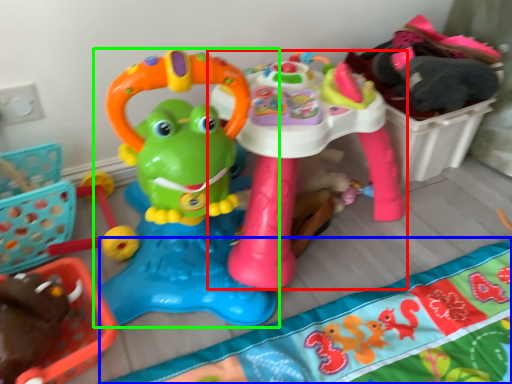
Question: Which is farther away from toy (highlighted by a red box)? blanket (highlighted by a blue box) or toy (highlighted by a green box)?

Choices:
 (A) blanket
 (B) toy

Answer: (A)